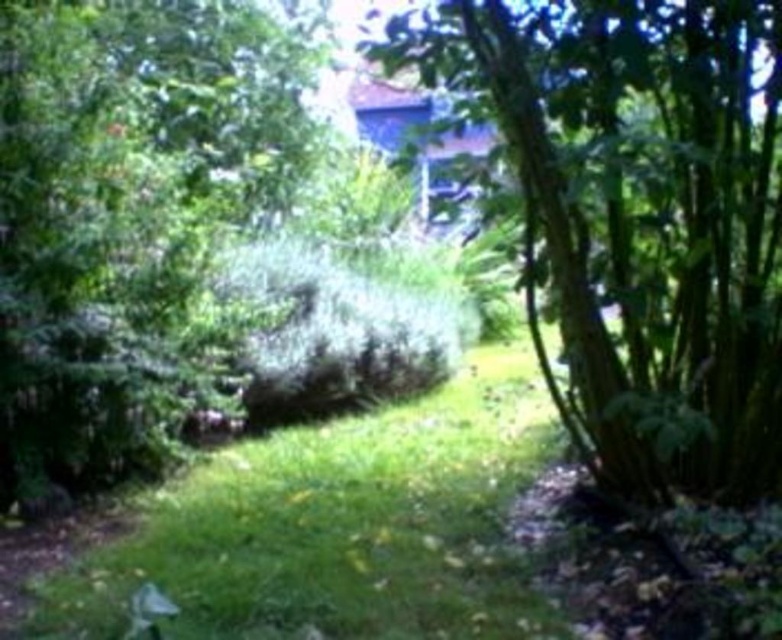
You are standing in the garden and see the green leafy tree at center and the green grass at center. Which object is positioned to the right when viewed from your perspective?

The green leafy tree at center is positioned to the right of the green grass at center.

You are standing in the garden and want to place a small statue between the two points, point [391,51] and point [155,538]. Will the statue be closer to the front or the back of the garden?

The statue will be closer to the front of the garden because point [391,51] is closer to the viewer than point [155,538].